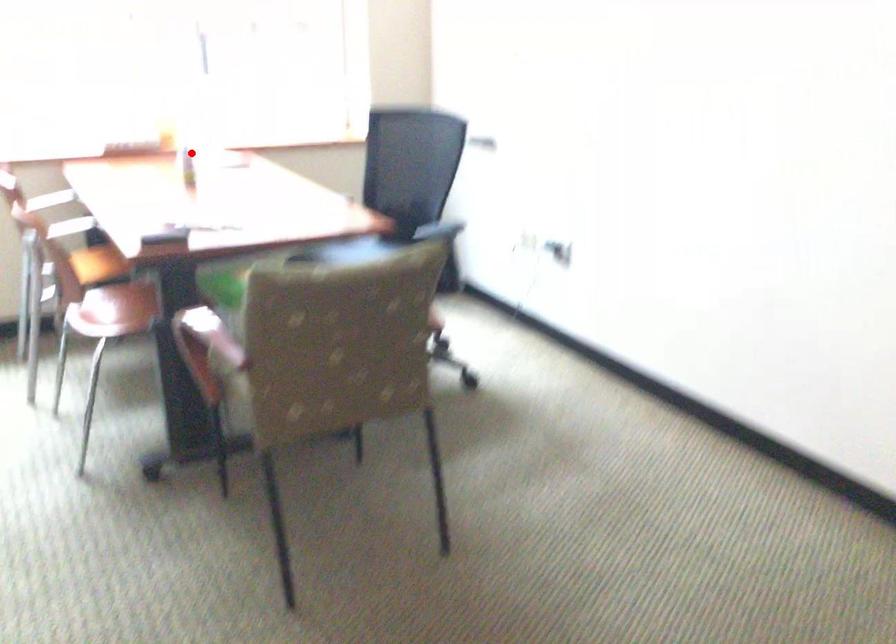
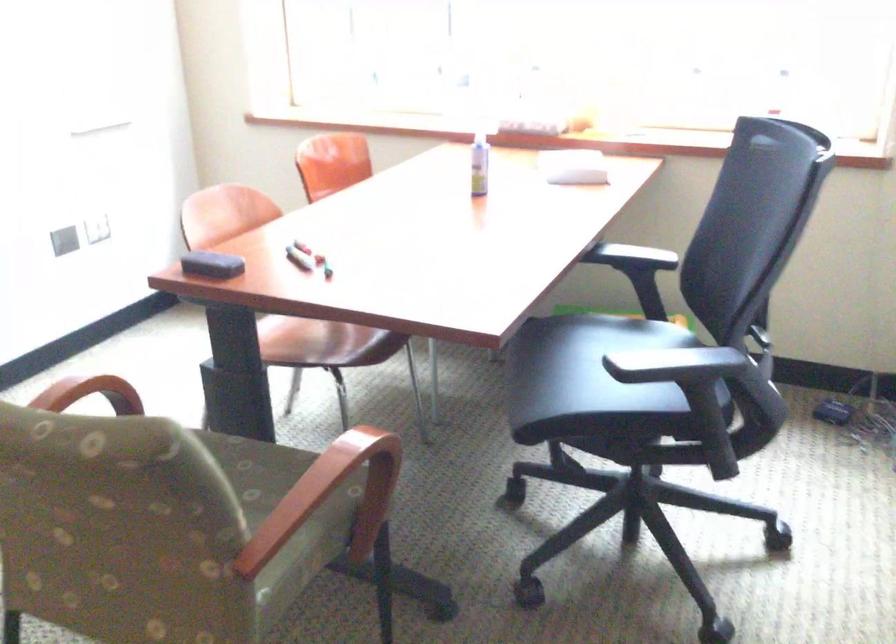
Question: I am providing you with two images of the same scene from different viewpoints. Given a red point in image1, look at the same physical point in image2. Is it:

Choices:
 (A) Closer to the viewpoint
 (B) Farther from the viewpoint

Answer: (A)